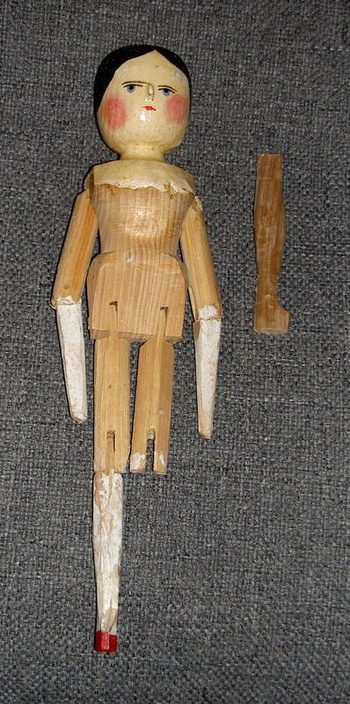
This screenshot has height=704, width=350. Identify the location of paint. (208, 346), (73, 336), (116, 515).